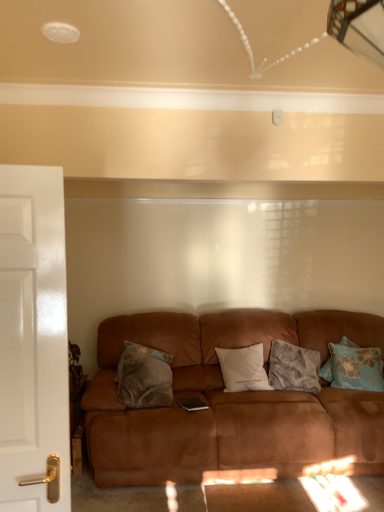
Question: From a real-world perspective, is white glossy door at left over blue floral pillow at right, the 4th pillow positioned from the left?

Choices:
 (A) no
 (B) yes

Answer: (B)

Question: Does white glossy door at left have a greater width compared to blue floral pillow at right, the 4th pillow positioned from the left?

Choices:
 (A) yes
 (B) no

Answer: (B)

Question: Does white glossy door at left contain blue floral pillow at right, the 4th pillow positioned from the left?

Choices:
 (A) no
 (B) yes

Answer: (A)

Question: Is white glossy door at left directly adjacent to blue floral pillow at right, the 4th pillow positioned from the left?

Choices:
 (A) no
 (B) yes

Answer: (A)

Question: Is white glossy door at left completely or partially outside of blue floral pillow at right, the 1th pillow when ordered from right to left?

Choices:
 (A) no
 (B) yes

Answer: (B)

Question: Is blue floral pillow at right, the 4th pillow positioned from the left, at the back of white glossy door at left?

Choices:
 (A) yes
 (B) no

Answer: (B)

Question: Is the position of white glossy door at left more distant than that of suede brown couch at center?

Choices:
 (A) no
 (B) yes

Answer: (A)

Question: Does white glossy door at left have a larger size compared to suede brown couch at center?

Choices:
 (A) yes
 (B) no

Answer: (B)

Question: Is white glossy door at left to the right of suede brown couch at center from the viewer's perspective?

Choices:
 (A) no
 (B) yes

Answer: (A)

Question: From the image's perspective, does white glossy door at left appear higher than suede brown couch at center?

Choices:
 (A) no
 (B) yes

Answer: (B)

Question: Considering the relative positions of white glossy door at left and suede brown couch at center in the image provided, is white glossy door at left to the left of suede brown couch at center from the viewer's perspective?

Choices:
 (A) yes
 (B) no

Answer: (A)

Question: From the image's perspective, is white glossy door at left below suede brown couch at center?

Choices:
 (A) no
 (B) yes

Answer: (A)

Question: Could you tell me if white soft cushion at center, acting as the 2th pillow starting from the left, is turned towards fluffy gray pillow at center, the third pillow positioned from the left?

Choices:
 (A) yes
 (B) no

Answer: (B)